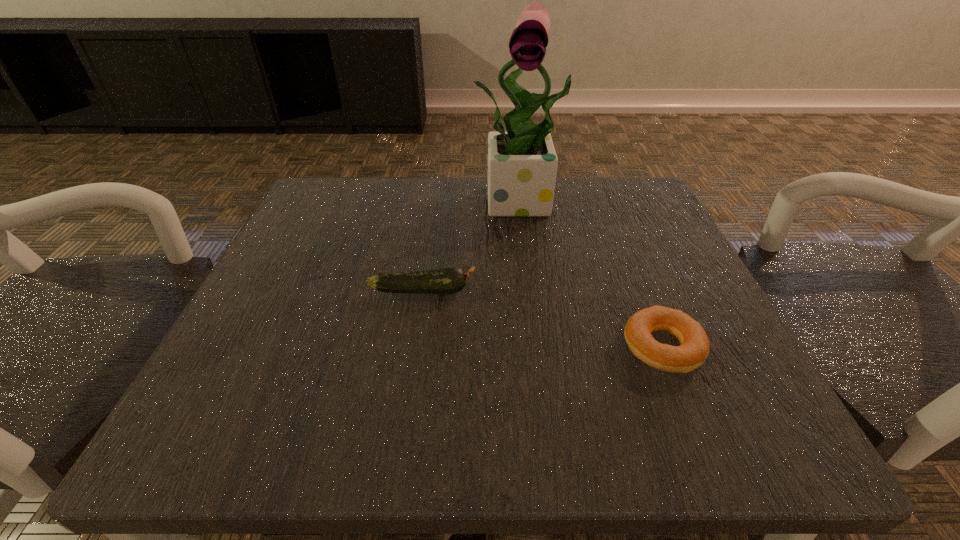
Image resolution: width=960 pixels, height=540 pixels. In the image, there is a desktop. Find the location of `free space at the far edge`. free space at the far edge is located at coordinates (394, 220).

Where is `vacant area at the near edge`? The image size is (960, 540). vacant area at the near edge is located at coordinates (515, 434).

I want to click on vacant space at the left edge of the desktop, so click(308, 288).

I want to click on free space at the right edge, so click(606, 279).

In order to click on vacant space at the far left corner of the desktop in this screenshot , I will do `click(366, 194)`.

Image resolution: width=960 pixels, height=540 pixels. What are the coordinates of `vacant space at the near left corner of the desktop` in the screenshot? It's located at (170, 445).

In the image, there is a desktop. Where is `vacant space at the far right corner`? This screenshot has height=540, width=960. vacant space at the far right corner is located at coordinates (598, 231).

You are a GUI agent. You are given a task and a screenshot of the screen. Output one action in this format:
    pyautogui.click(x=<x>, y=<y>)
    Task: Click on the vacant space at the near right corner of the desktop
    The image size is (960, 540).
    Given the screenshot: What is the action you would take?
    pyautogui.click(x=703, y=392)

This screenshot has width=960, height=540. Find the location of `free area in between the nearest object and the zucchini`. free area in between the nearest object and the zucchini is located at coordinates (542, 319).

Where is `empty space between the zucchini and the tallest object`? The height and width of the screenshot is (540, 960). empty space between the zucchini and the tallest object is located at coordinates (473, 245).